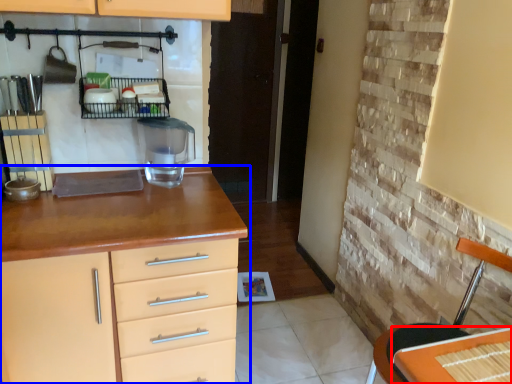
Question: Which point is further to the camera, table (highlighted by a red box) or chest of drawers (highlighted by a blue box)?

Choices:
 (A) table
 (B) chest of drawers

Answer: (B)